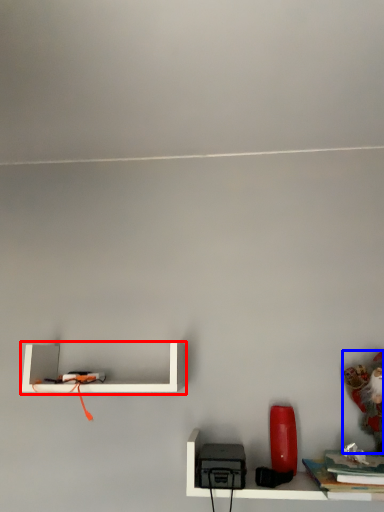
Question: Which of the following is the closest to the observer, shelf (highlighted by a red box) or toy (highlighted by a blue box)?

Choices:
 (A) shelf
 (B) toy

Answer: (B)